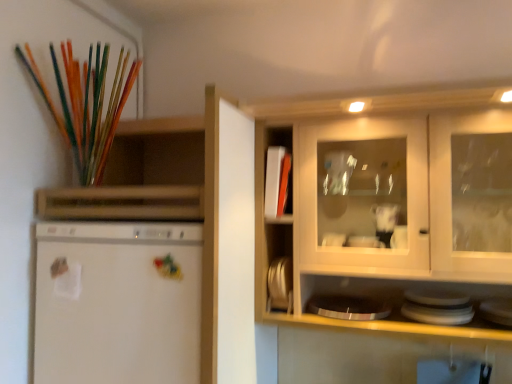
Identify the location of empty space that is ontop of white glossy plate at lower right, which is the second appliance from back to front (from a real-world perspective). This screenshot has height=384, width=512. (497, 306).